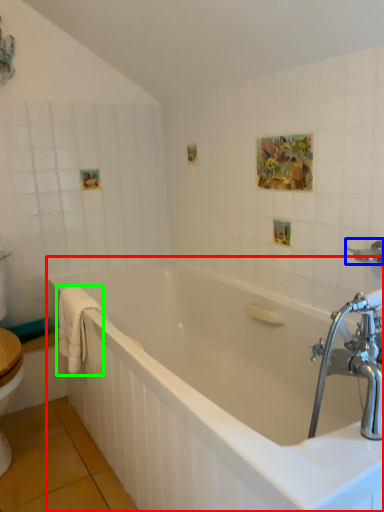
Question: Which object is the farthest from bathtub (highlighted by a red box)? Choose among these: shower (highlighted by a blue box) or bath towel (highlighted by a green box).

Choices:
 (A) shower
 (B) bath towel

Answer: (A)